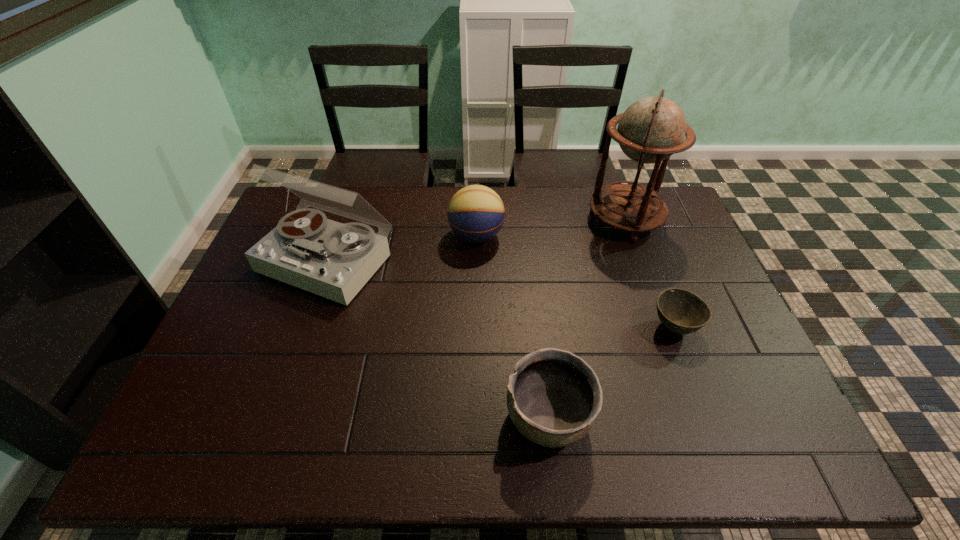
You are a GUI agent. You are given a task and a screenshot of the screen. Output one action in this format:
    pyautogui.click(x=<x>, y=<y>)
    Task: Click on the free region located 0.390m on the surface of the globe
    
    Given the screenshot: What is the action you would take?
    pyautogui.click(x=475, y=220)

This screenshot has width=960, height=540. In order to click on vacant region located 0.150m on the back of the second tallest object in this screenshot , I will do `click(349, 197)`.

Find the location of a particular element. This screenshot has height=540, width=960. free point located on the patterned surface of the third tallest object is located at coordinates (621, 236).

Locate an element on the screen. free space located 0.270m on the back of the pottery is located at coordinates (535, 297).

You are a GUI agent. You are given a task and a screenshot of the screen. Output one action in this format:
    pyautogui.click(x=<x>, y=<y>)
    Task: Click on the free space located 0.140m on the left of the fourth farthest object
    
    Given the screenshot: What is the action you would take?
    pyautogui.click(x=598, y=327)

Where is `globe that is at the far edge`? globe that is at the far edge is located at coordinates (653, 128).

Locate an element on the screen. The width and height of the screenshot is (960, 540). record player that is at the far edge is located at coordinates (334, 260).

Locate an element on the screen. This screenshot has width=960, height=540. basketball that is at the far edge is located at coordinates (476, 213).

The height and width of the screenshot is (540, 960). I want to click on object that is positioned at the near edge, so click(553, 398).

At what (x,y) coordinates should I click in order to perform the action: click on object located at the left edge. Please return your answer as a coordinate pair (x, y). This screenshot has width=960, height=540. Looking at the image, I should click on (334, 260).